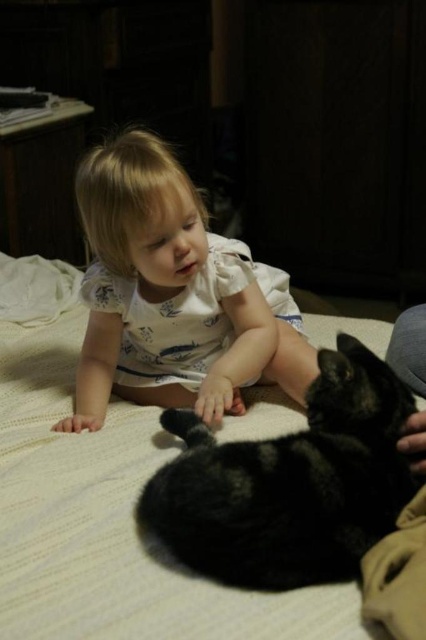
Does white cotton toddler at center appear on the left side of black fur cat at lower center?

Correct, you'll find white cotton toddler at center to the left of black fur cat at lower center.

Which is in front, point (126, 147) or point (244, 451)?

Positioned in front is point (244, 451).

Where is `white cotton toddler at center`? The width and height of the screenshot is (426, 640). white cotton toddler at center is located at coordinates (170, 294).

From the picture: Is white soft bed at center to the left of black fur cat at lower center from the viewer's perspective?

Yes, white soft bed at center is to the left of black fur cat at lower center.

Between point (124, 493) and point (374, 417), which one is positioned behind?

The point (124, 493) is more distant.

The image size is (426, 640). Describe the element at coordinates (104, 502) in the screenshot. I see `white soft bed at center` at that location.

Locate an element on the screen. white soft bed at center is located at coordinates (104, 502).

Who is more distant from viewer, (x=311, y=323) or (x=305, y=358)?

The point (x=311, y=323) is behind.

Is point (40, 481) closer to camera compared to point (138, 268)?

Yes, point (40, 481) is closer to viewer.

This screenshot has height=640, width=426. What are the coordinates of `white soft bed at center` in the screenshot? It's located at (104, 502).